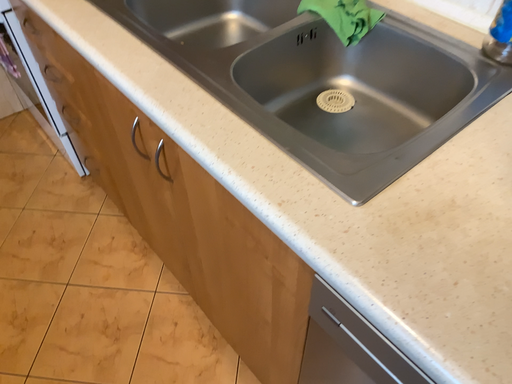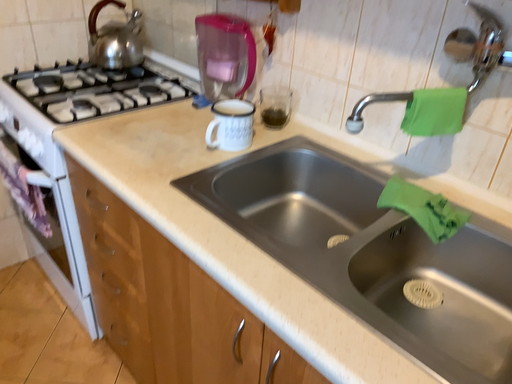
Question: Which way did the camera rotate in the video?

Choices:
 (A) rotated upward
 (B) rotated downward

Answer: (A)